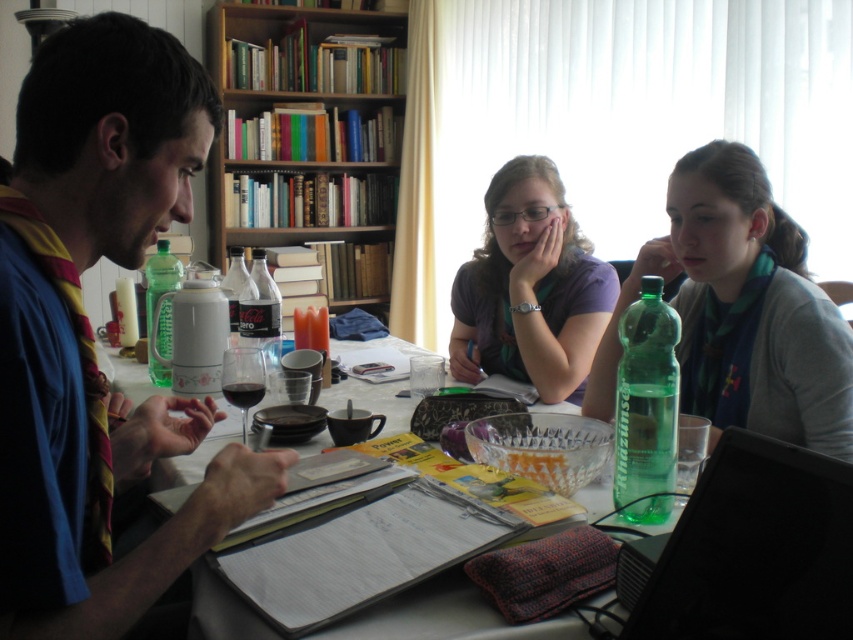
You are at a table with a clear glass bottle at center and a green translucent bottle at center. If you need to pour more liquid into the one that can hold more, which bottle should you choose?

The green translucent bottle at center is larger in size, so you should pour more liquid into the green translucent bottle at center.

You are a photographer taking a picture of the purple matte shirt at center and the clear glass bottle at center. Which object will appear larger in the photo?

The purple matte shirt at center will appear larger in the photo because it is closer to the viewer than the clear glass bottle at center.

You are sitting at the table in the scene and want to reach for an item located at point (525, 316) and another item at point (273, 305). Which item will you need to reach further back to get?

Point (273, 305) is further away from you than point (525, 316), so you will need to reach further back to get the item at point (273, 305).